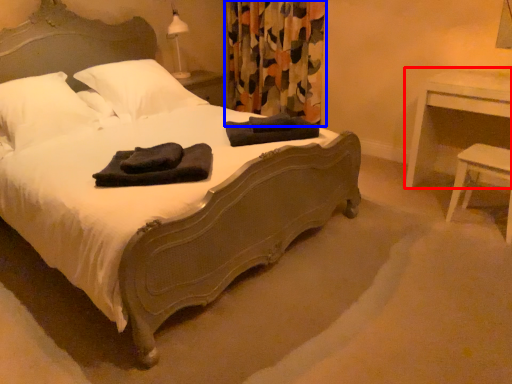
Question: Which point is closer to the camera, nightstand (highlighted by a red box) or curtain (highlighted by a blue box)?

Choices:
 (A) nightstand
 (B) curtain

Answer: (A)